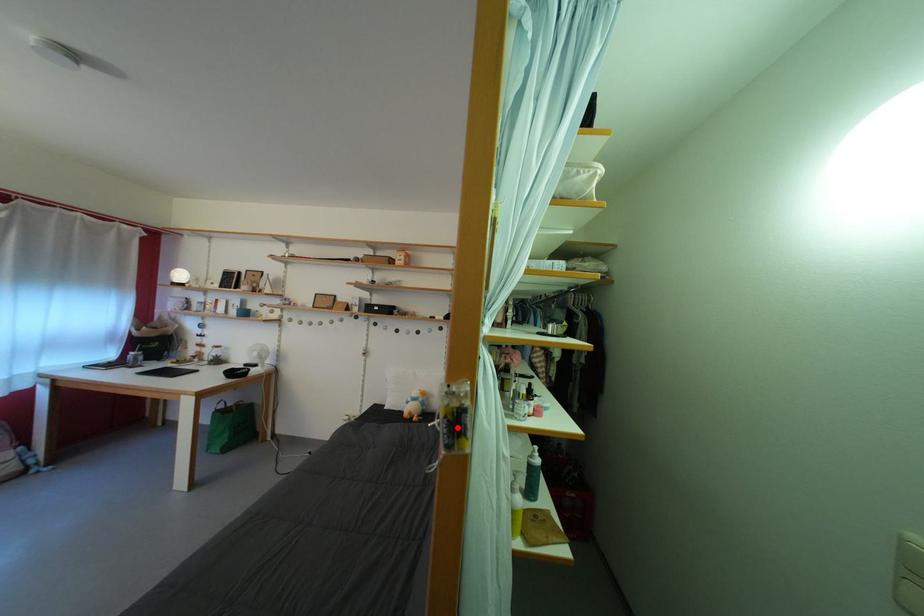
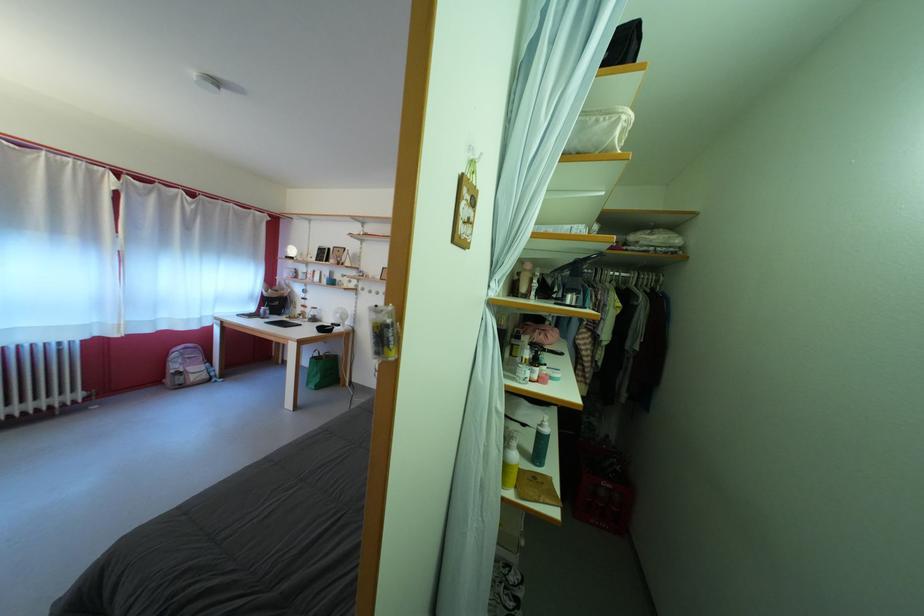
Where in the second image is the point corresponding to the highlighted location from the first image?

(383, 339)